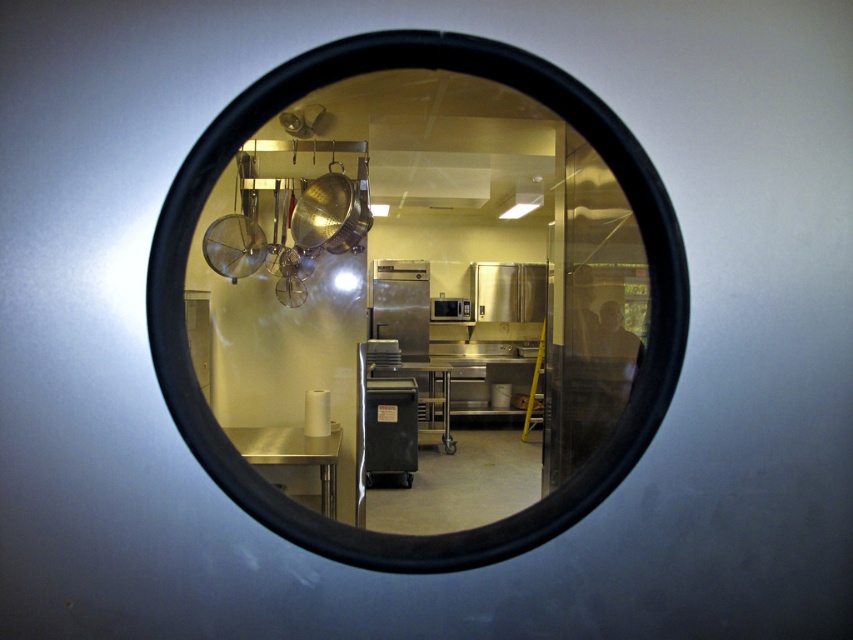
Question: Is stainless steel pots at upper center further to the viewer compared to black plastic cart at center?

Choices:
 (A) yes
 (B) no

Answer: (A)

Question: Estimate the real-world distances between objects in this image. Which object is closer to the stainless steel pots at upper center?

Choices:
 (A) black plastic cart at center
 (B) satin silver microwave at center
 (C) stainless steel appliance at center

Answer: (A)

Question: Is stainless steel pots at upper center positioned behind black plastic cart at center?

Choices:
 (A) no
 (B) yes

Answer: (B)

Question: Considering the relative positions of black plastic cart at center and stainless steel appliance at center in the image provided, where is black plastic cart at center located with respect to stainless steel appliance at center?

Choices:
 (A) below
 (B) above

Answer: (A)

Question: Among these objects, which one is farthest from the camera?

Choices:
 (A) stainless steel pots at upper center
 (B) satin silver microwave at center
 (C) stainless steel appliance at center

Answer: (B)

Question: Which object is closer to the camera taking this photo?

Choices:
 (A) stainless steel appliance at center
 (B) stainless steel pots at upper center
 (C) satin silver microwave at center

Answer: (B)